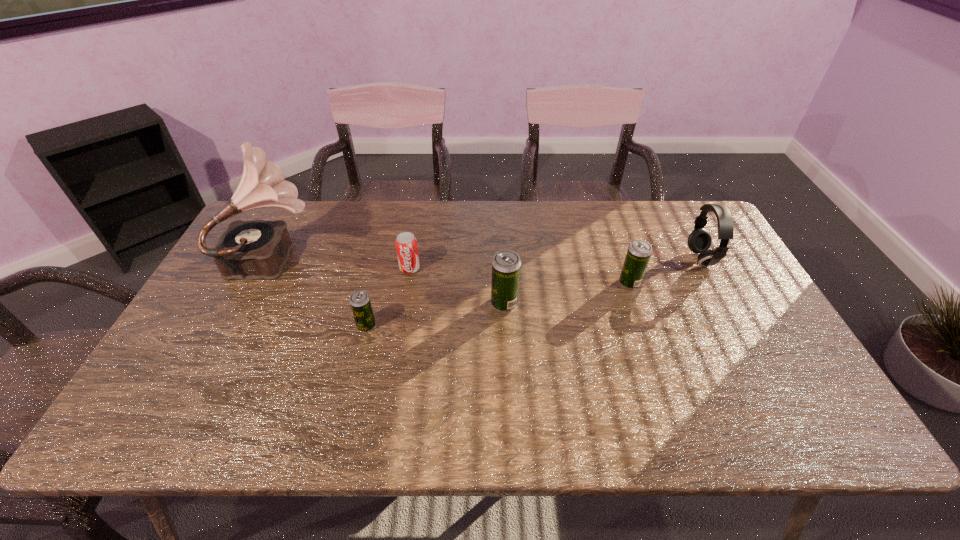
Locate an element on the screen. Image resolution: width=960 pixels, height=540 pixels. free spot located on the back of the second object from left to right is located at coordinates (389, 231).

The width and height of the screenshot is (960, 540). I want to click on free space located on the back of the tallest beer can, so click(x=499, y=211).

This screenshot has height=540, width=960. What are the coordinates of `vacant area situated on the back of the second object from right to left` in the screenshot? It's located at (602, 201).

Image resolution: width=960 pixels, height=540 pixels. I want to click on vacant region located from the horn of the record player, so click(451, 257).

Locate an element on the screen. free space located on the logo side of the fourth object from right to left is located at coordinates (389, 393).

Locate an element on the screen. free space located 0.250m on the ear cups of the rightmost object is located at coordinates (607, 259).

The height and width of the screenshot is (540, 960). Identify the location of free region located on the ear cups of the rightmost object. (633, 259).

You are a GUI agent. You are given a task and a screenshot of the screen. Output one action in this format:
    pyautogui.click(x=<x>, y=<y>)
    Task: Click on the vacant area situated on the ear cups of the rightmost object
    The image size is (960, 540).
    Given the screenshot: What is the action you would take?
    pyautogui.click(x=581, y=259)

Identify the location of record player that is positioned at the far edge. (258, 249).

Identify the location of earphone situated at the far edge. The width and height of the screenshot is (960, 540). (699, 241).